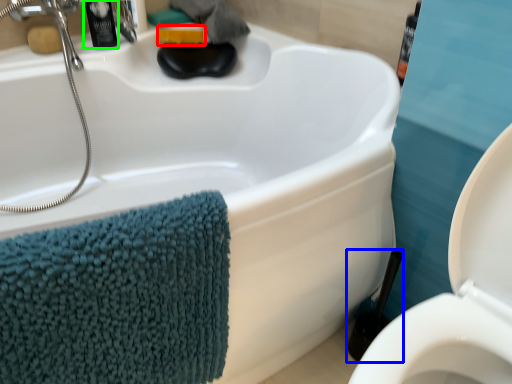
Question: Which object is positioned farthest from soap (highlighted by a red box)? Select from brush (highlighted by a blue box) and toiletry (highlighted by a green box).

Choices:
 (A) brush
 (B) toiletry

Answer: (A)